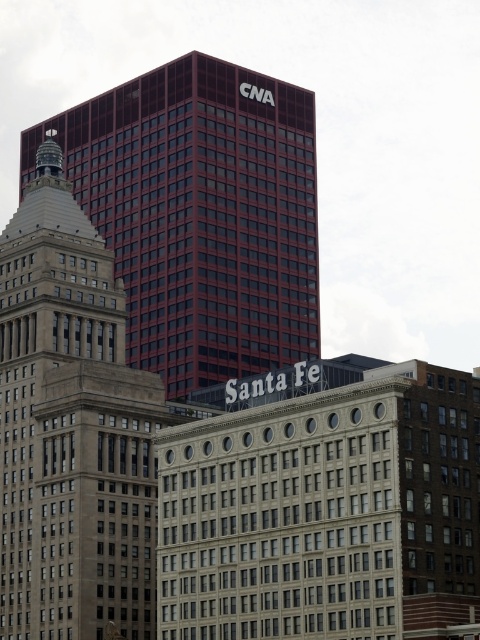
You are an architect analyzing the cityscape. You need to determine which of the two buildings, the maroon glass building at center or the beige stone tower at center, has a greater horizontal span. Based on the scene, which one is wider?

The maroon glass building at center has a greater horizontal span than the beige stone tower at center because its width is larger according to the description.

You are an architect analyzing the city skyline. Based on the scene, which of the two buildings, the maroon glass building at center or the beige stone tower at center, has a lower height?

The maroon glass building at center is not as tall as the beige stone tower at center, so the maroon glass building at center has a lower height.

You are a drone operator planning to fly a drone between the maroon glass building at center and the beige stone tower at center. The drone has a maximum flight distance of 15 meters. Can the drone safely travel between the two buildings without exceeding its range?

The maroon glass building at center and beige stone tower at center are 15.74 meters apart. Since the drone can only fly up to 15 meters, it cannot safely travel between them as the distance exceeds its maximum range.